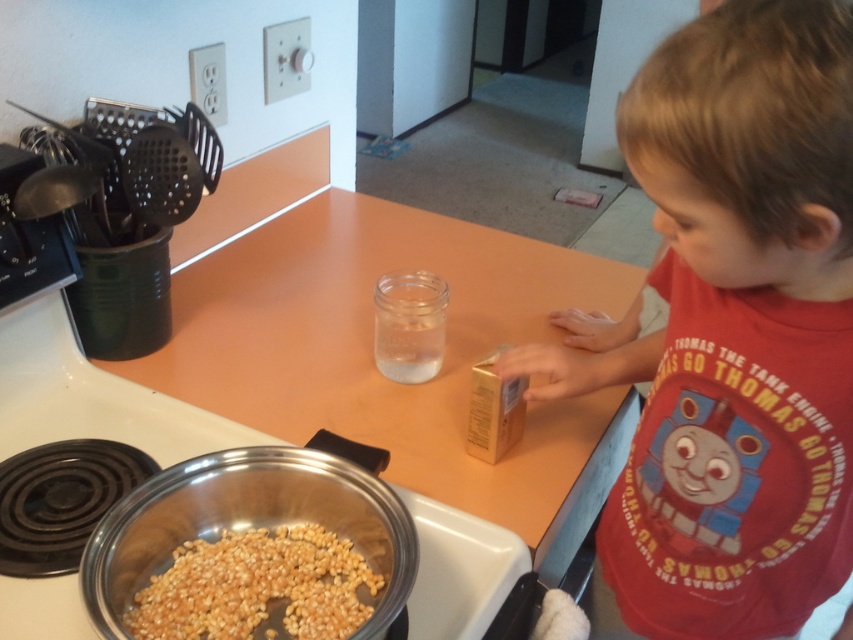
Question: In this image, where is thomas the tank engine shirt at center located relative to yellow matte popcorn at lower left?

Choices:
 (A) left
 (B) right

Answer: (B)

Question: From the image, what is the correct spatial relationship of thomas the tank engine shirt at center in relation to yellow matte popcorn at lower left?

Choices:
 (A) right
 (B) left

Answer: (A)

Question: Does thomas the tank engine shirt at center have a smaller size compared to yellow matte popcorn at lower left?

Choices:
 (A) yes
 (B) no

Answer: (B)

Question: Which point is closer to the camera?

Choices:
 (A) thomas the tank engine shirt at center
 (B) stainless steel pot at lower left

Answer: (A)

Question: Which point is closer to the camera?

Choices:
 (A) stainless steel pot at lower left
 (B) metallic silver bowl at lower left
 (C) thomas the tank engine shirt at center
 (D) yellow matte popcorn at lower left

Answer: (C)

Question: Among these objects, which one is nearest to the camera?

Choices:
 (A) thomas the tank engine shirt at center
 (B) smooth orange countertop at center

Answer: (A)